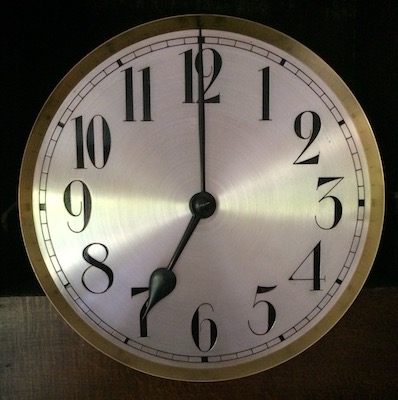
You are a GUI agent. You are given a task and a screenshot of the screen. Output one action in this format:
    pyautogui.click(x=<x>, y=<y>)
    Task: Click on the light reflecting off clock
    
    Given the screenshot: What is the action you would take?
    pyautogui.click(x=116, y=216), pyautogui.click(x=287, y=194)